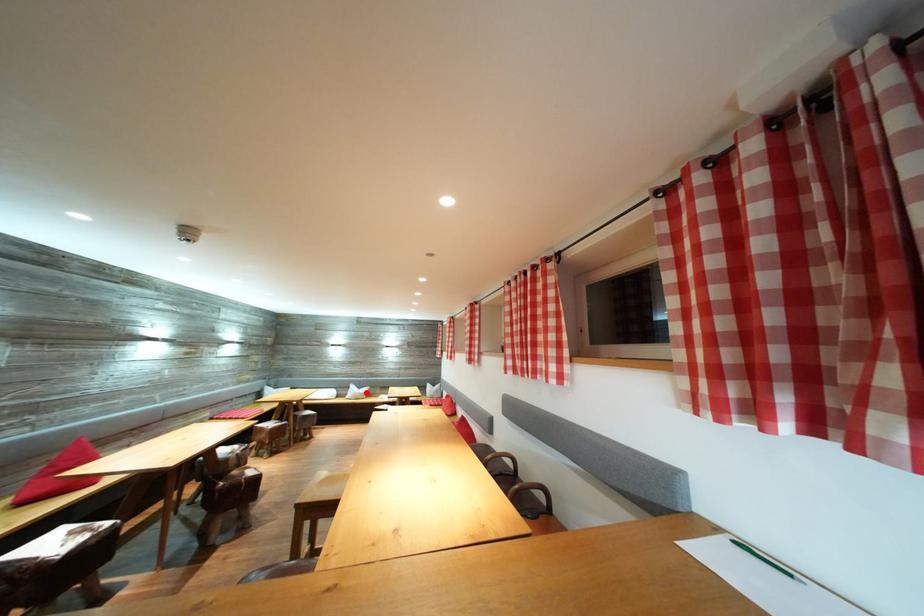
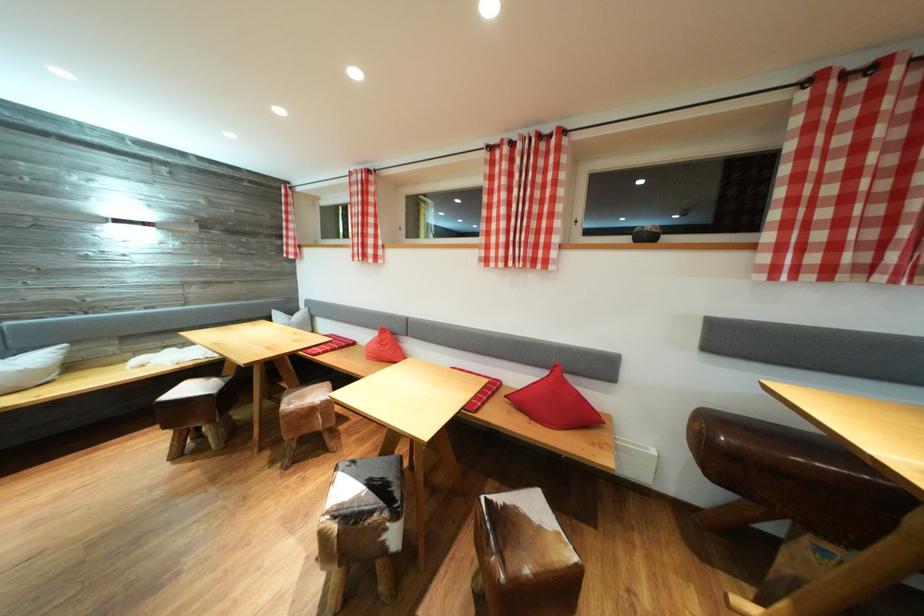
The point at the highlighted location is marked in the first image. Where is the corresponding point in the second image?

(14, 358)